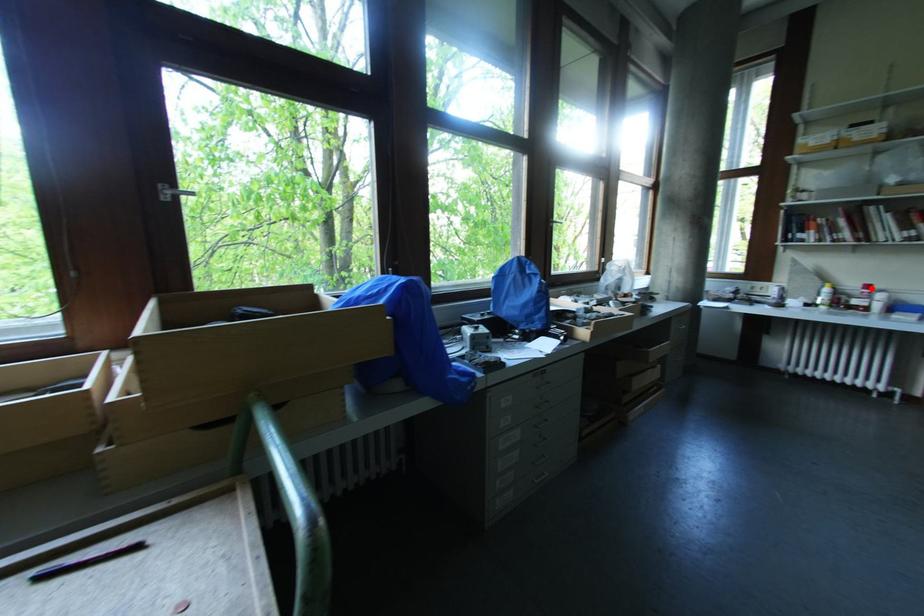
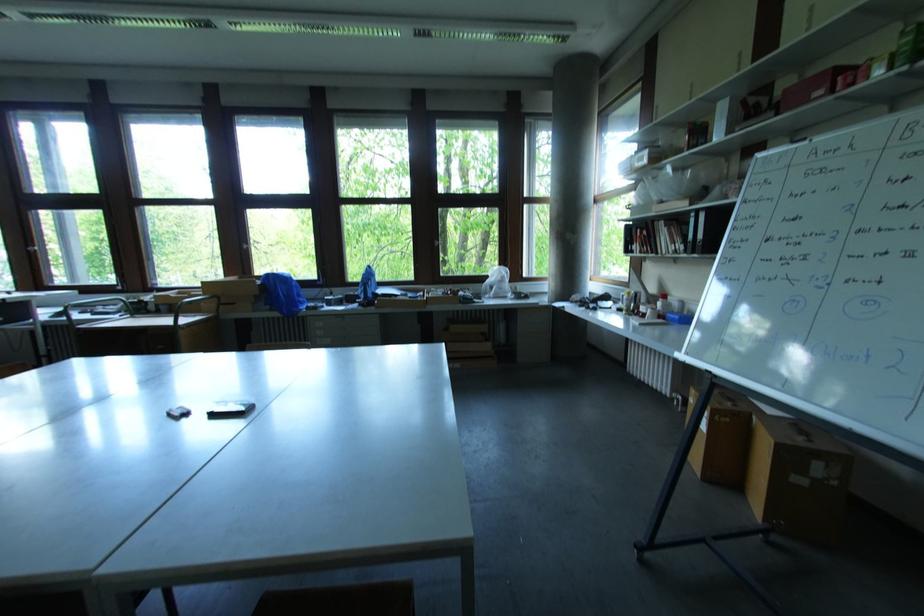
Find the pixel in the second image that matches the highlighted location in the first image.

(667, 298)